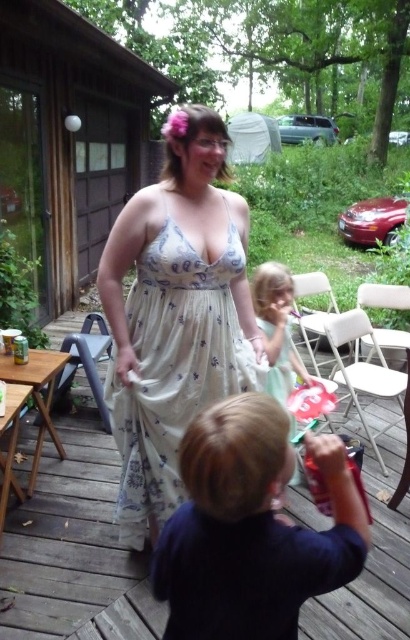
You are a photographer setting up for a family photo. You have two subjects wearing the dark blue shirt at lower center and the white floral dress at center. Which clothing item takes up more space horizontally in the frame?

The white floral dress at center takes up more space horizontally in the frame because the dark blue shirt at lower center has a lesser width compared to it.

You are standing on the wooden deck at center and want to greet the person wearing the dark blue shirt at lower center. In which direction should you walk to reach them?

You should walk to the right because the dark blue shirt at lower center is to the right of the wooden deck at center.